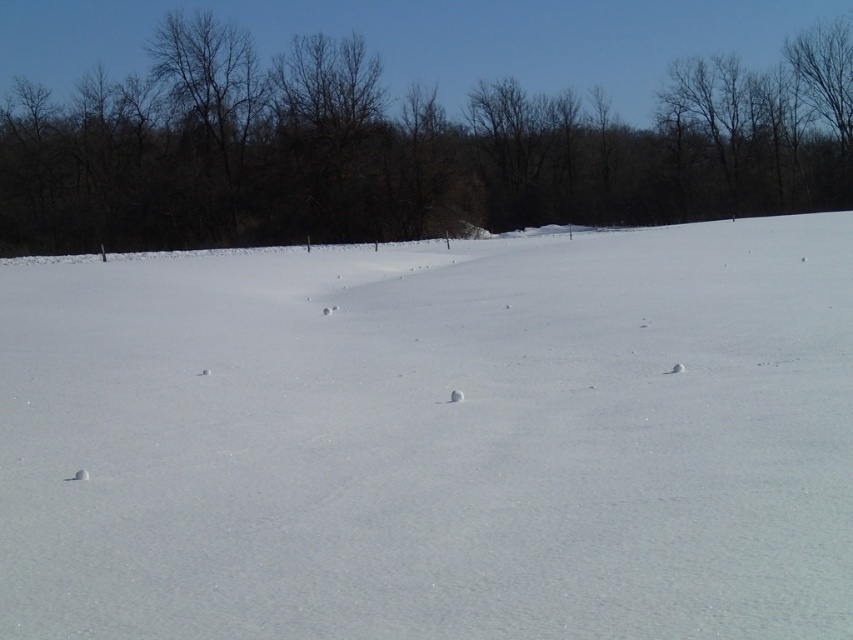
Question: Which point appears farthest from the camera in this image?

Choices:
 (A) (537, 129)
 (B) (325, 579)

Answer: (A)

Question: Can you confirm if white snow at center is smaller than brown leafless trees at upper center?

Choices:
 (A) yes
 (B) no

Answer: (A)

Question: Among these points, which one is farthest from the camera?

Choices:
 (A) (363, 104)
 (B) (630, 394)

Answer: (A)

Question: Which object appears closest to the camera in this image?

Choices:
 (A) brown leafless trees at upper center
 (B) white snow at center

Answer: (B)

Question: Is white snow at center behind brown leafless trees at upper center?

Choices:
 (A) no
 (B) yes

Answer: (A)

Question: Is white snow at center closer to camera compared to brown leafless trees at upper center?

Choices:
 (A) yes
 (B) no

Answer: (A)